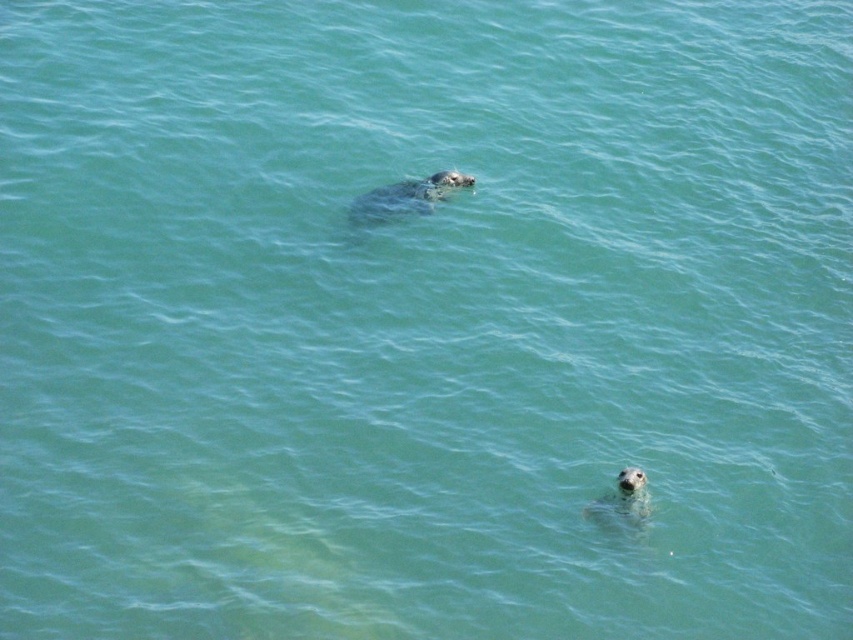
Question: Is gray fur seal at upper center thinner than gray matte seal at lower center?

Choices:
 (A) no
 (B) yes

Answer: (B)

Question: Which of the following is the closest to the observer?

Choices:
 (A) gray matte seal at lower center
 (B) gray fur seal at upper center

Answer: (A)

Question: Is gray fur seal at upper center positioned behind gray matte seal at lower center?

Choices:
 (A) yes
 (B) no

Answer: (A)

Question: Which point is closer to the camera?

Choices:
 (A) (605, 525)
 (B) (393, 188)

Answer: (A)

Question: Can you confirm if gray fur seal at upper center is bigger than gray matte seal at lower center?

Choices:
 (A) yes
 (B) no

Answer: (B)

Question: Which point is farther to the camera?

Choices:
 (A) pyautogui.click(x=445, y=173)
 (B) pyautogui.click(x=643, y=483)

Answer: (A)